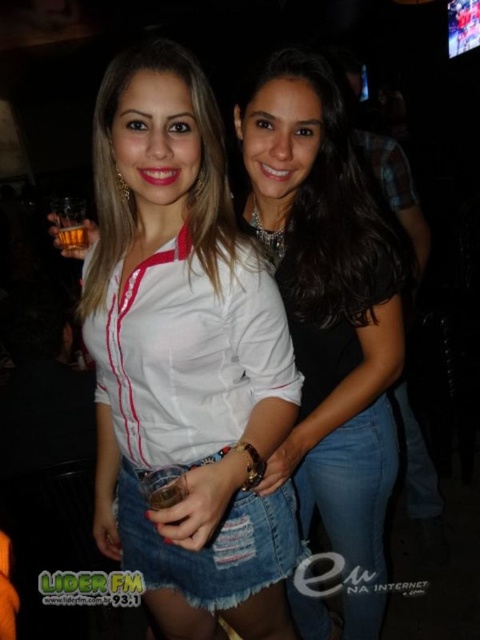
You are a photographer at the event and want to capture a closeup shot of the white matte shirt at center and the translucent amber glass at center. The camera can only focus on objects within a 20 inch range. Will both items be in focus?

The white matte shirt at center is 22.36 inches from the translucent amber glass at center, which exceeds the camera focus range of 20 inches. Therefore, both items cannot be in focus simultaneously.

You are a photographer at the event and need to ensure both the white matte shirt at center and the translucent amber glass at center are clearly visible in your photo. Since you can only focus on one object at a time, which object should you focus on to ensure the other is still in the frame?

The white matte shirt at center is wider than the translucent amber glass at center, so focusing on the shirt will ensure the glass remains in the frame as it is smaller and positioned within the same central area.

You are a photographer at the event and need to adjust the lighting to ensure both the white matte shirt at center and the translucent amber glass at center are well lit. Based on their positions, which object should you focus on first to ensure proper exposure?

The white matte shirt at center is below the translucent amber glass at center, so you should focus on the translucent amber glass at center first to ensure it is properly lit before adjusting for the shirt below.